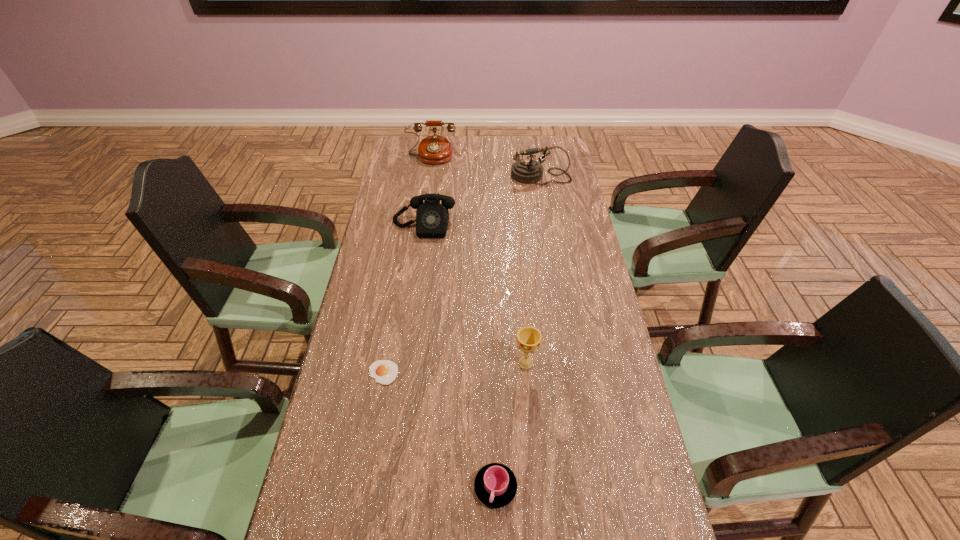
In order to click on the farthest object in this screenshot , I will do `click(435, 149)`.

I want to click on the second farthest object, so (527, 171).

I want to click on the rightmost telephone, so (527, 171).

This screenshot has width=960, height=540. In order to click on chalice in this screenshot , I will do `click(529, 339)`.

You are a GUI agent. You are given a task and a screenshot of the screen. Output one action in this format:
    pyautogui.click(x=<x>, y=<y>)
    Task: Click on the third farthest object
    This screenshot has width=960, height=540.
    Given the screenshot: What is the action you would take?
    pyautogui.click(x=432, y=218)

I want to click on the nearest telephone, so click(432, 218).

Find the location of a particular element. the nearest object is located at coordinates (495, 484).

This screenshot has width=960, height=540. Find the location of `the fourth object from left to right`. the fourth object from left to right is located at coordinates (495, 484).

You are a GUI agent. You are given a task and a screenshot of the screen. Output one action in this format:
    pyautogui.click(x=<x>, y=<y>)
    Task: Click on the egg yolk
    
    Given the screenshot: What is the action you would take?
    pyautogui.click(x=384, y=372)

This screenshot has height=540, width=960. Find the location of `vacant space positioned 0.080m on the dial of the farthest object`. vacant space positioned 0.080m on the dial of the farthest object is located at coordinates (428, 176).